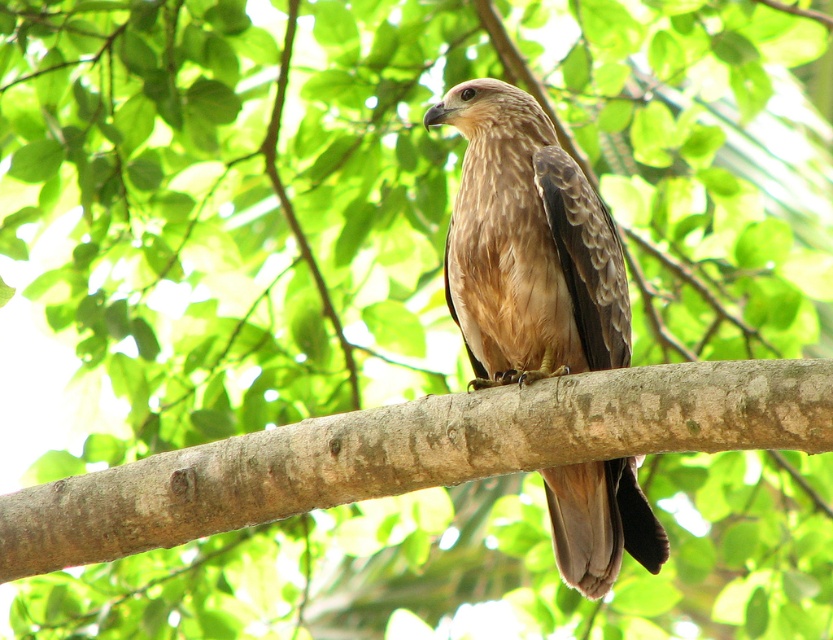
You are standing 10 feet away from the tree where the bird is perched. There is a point at coordinates point (223, 499). Can you determine if this point is closer to you than the tree?

The distance of point (223, 499) from camera is 8.75 feet, which is closer than your current position at 10 feet away. Therefore, the point is closer to you than the tree.

You are a birdwatcher observing the brown feathered eagle at center and the brown rough tree branch at center. Which object takes up more space in the image?

The brown rough tree branch at center is larger in size than the brown feathered eagle at center, so it takes up more space in the image.

You are a nature photographer aiming to capture the brown feathered eagle at center perched on the brown rough tree branch at center. Based on the scene description, which object is positioned lower in the image?

The brown rough tree branch at center is positioned below the brown feathered eagle at center, so it is lower in the image.